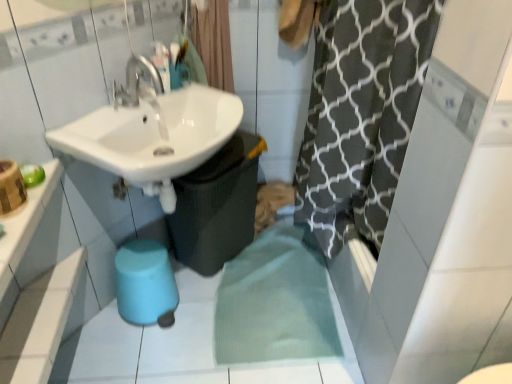
Find the location of a particular element. The image size is (512, 384). vacant space underneath white glossy counter top at upper left (from a real-world perspective) is located at coordinates tap(37, 314).